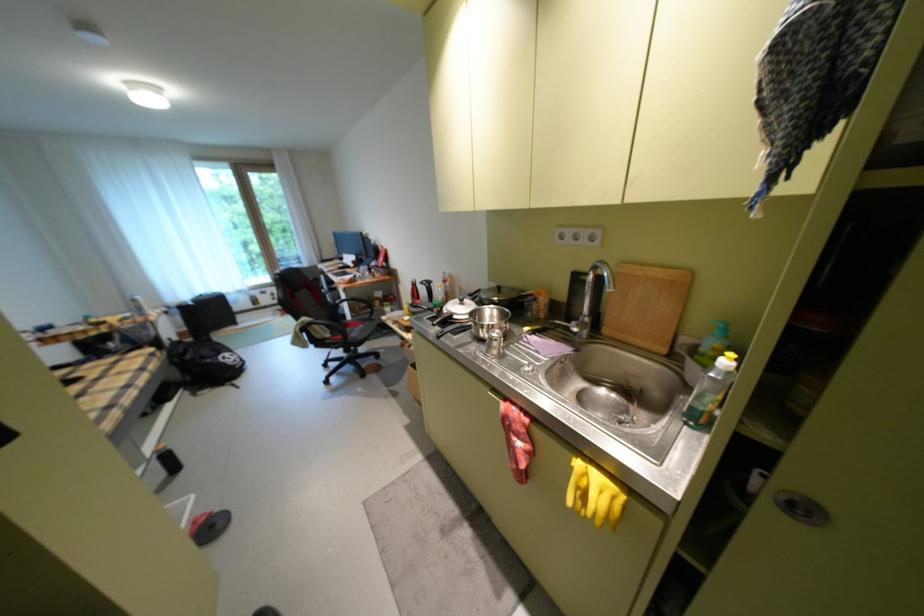
This screenshot has width=924, height=616. What do you see at coordinates (325, 320) in the screenshot? I see `the chair sitting surface` at bounding box center [325, 320].